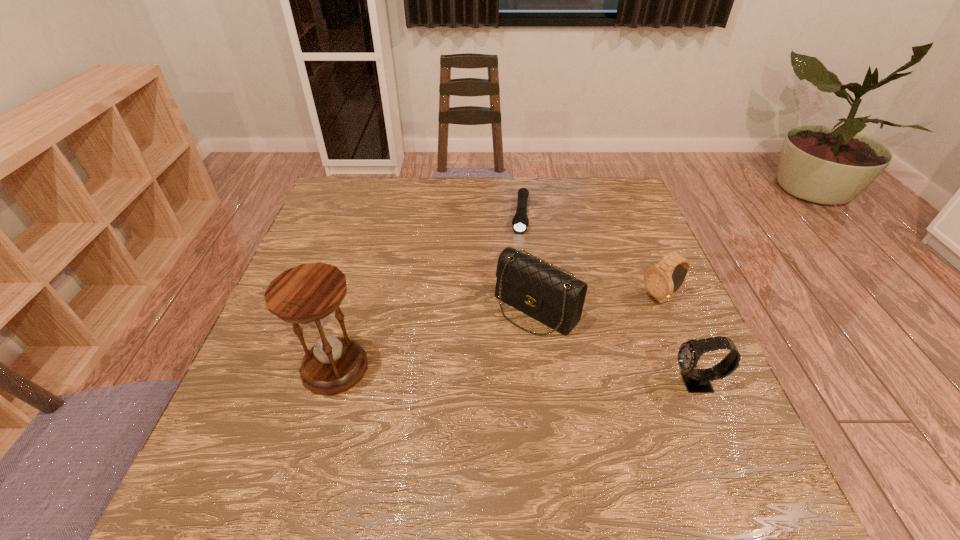
This screenshot has height=540, width=960. In order to click on the tallest object in this screenshot , I will do `click(307, 294)`.

Identify the location of the leftmost object. (307, 294).

You are a GUI agent. You are given a task and a screenshot of the screen. Output one action in this format:
    pyautogui.click(x=<x>, y=<y>)
    Task: Click on the nearer watch
    The width and height of the screenshot is (960, 540).
    Given the screenshot: What is the action you would take?
    pyautogui.click(x=696, y=380)

Image resolution: width=960 pixels, height=540 pixels. What are the coordinates of `the farthest object` in the screenshot? It's located at (520, 222).

Find the location of a particular element. the shortest object is located at coordinates (520, 222).

Image resolution: width=960 pixels, height=540 pixels. What are the coordinates of `the farther watch` in the screenshot? It's located at (660, 284).

I want to click on clutch bag, so click(529, 284).

At what (x,y) coordinates should I click in order to perform the action: click on free spot located on the right of the leftmost object. Please return your answer as a coordinate pair (x, y). Image resolution: width=960 pixels, height=540 pixels. Looking at the image, I should click on (469, 367).

You are a GUI agent. You are given a task and a screenshot of the screen. Output one action in this format:
    pyautogui.click(x=<x>, y=<y>)
    Task: Click on the vacant space situated 0.090m on the face of the nearer watch
    The image size is (960, 540).
    Given the screenshot: What is the action you would take?
    pyautogui.click(x=626, y=383)

Where is `vacant space situated 0.380m on the face of the nearer watch`? The width and height of the screenshot is (960, 540). vacant space situated 0.380m on the face of the nearer watch is located at coordinates (482, 383).